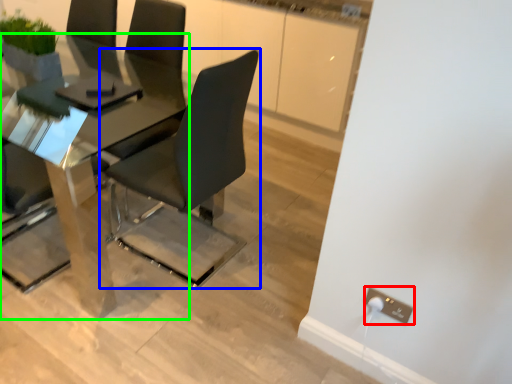
Question: Considering the real-world distances, which object is closest to electric outlet (highlighted by a red box)? chair (highlighted by a blue box) or table (highlighted by a green box).

Choices:
 (A) chair
 (B) table

Answer: (A)